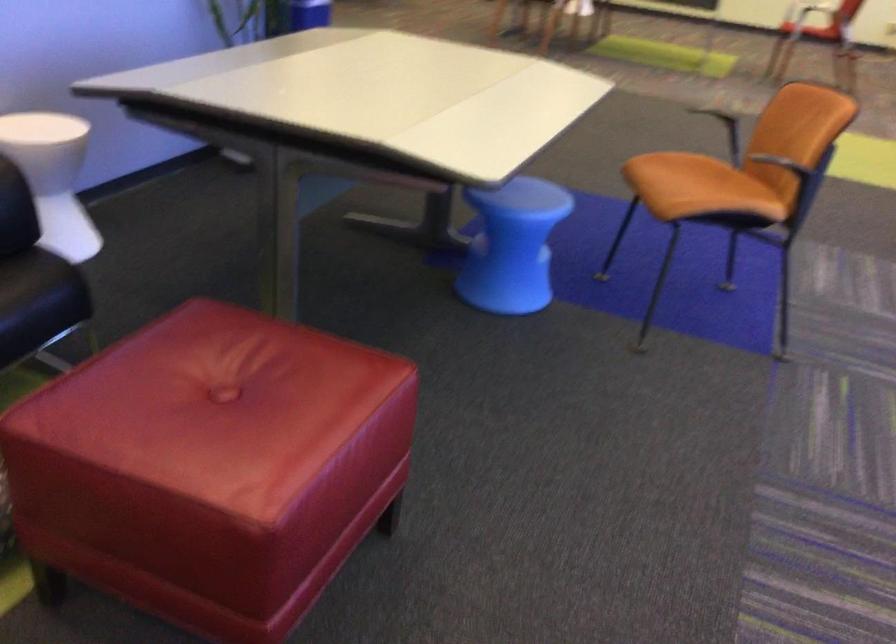
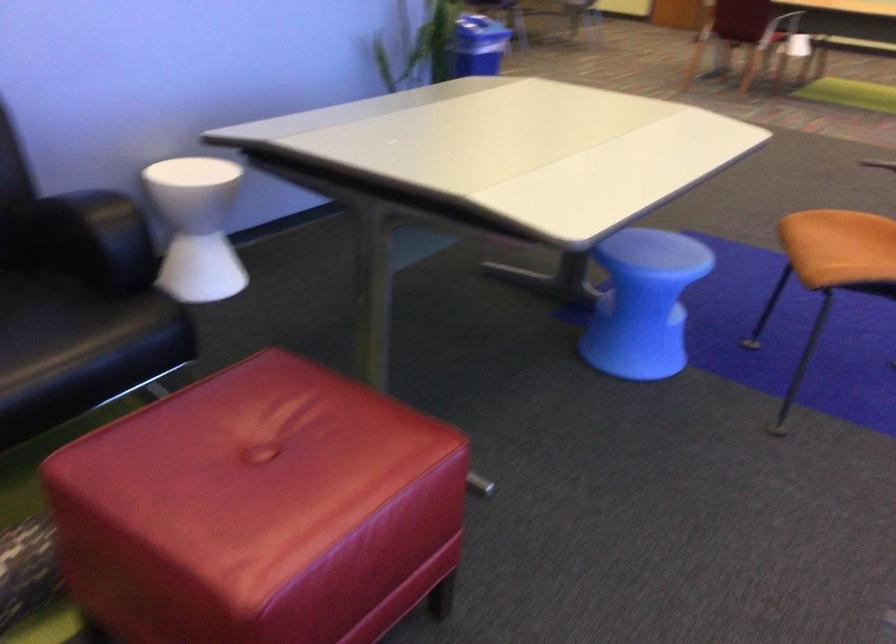
Question: How did the camera likely rotate?

Choices:
 (A) Left
 (B) Right
 (C) Up
 (D) Down

Answer: (A)